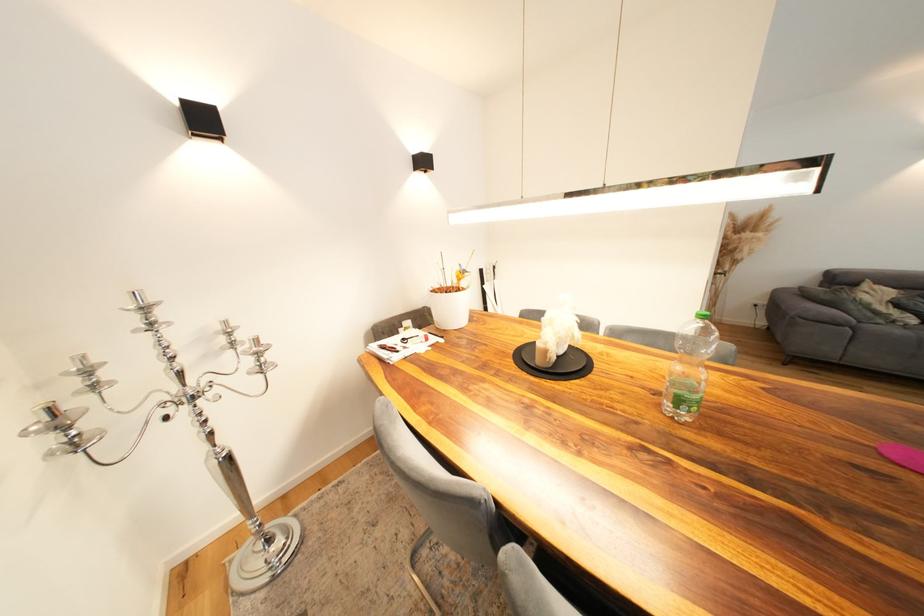
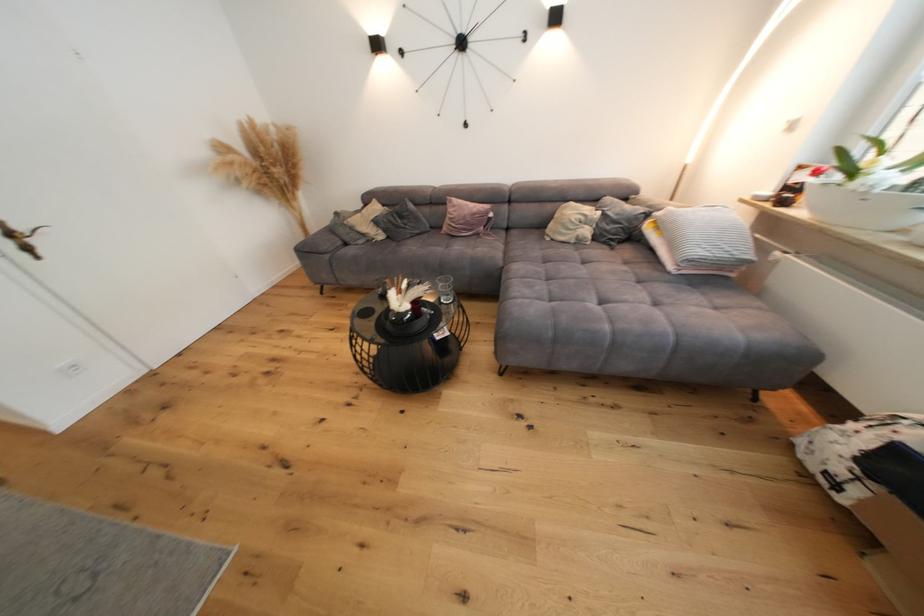
In the second image, find the point that corresponds to point (864, 317) in the first image.

(354, 240)